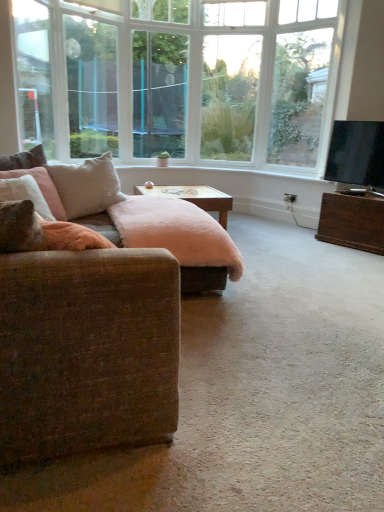
Where is `wooden coffee table at right, which appears as the second table when viewed from the left`? wooden coffee table at right, which appears as the second table when viewed from the left is located at coordinates (352, 221).

What do you see at coordinates (194, 197) in the screenshot? The width and height of the screenshot is (384, 512). I see `woodenobject at center, which is the first table in left-to-right order` at bounding box center [194, 197].

Measure the distance between white soft pillow at upper left, the first pillow from the right, and camera.

white soft pillow at upper left, the first pillow from the right, is 2.67 meters away from camera.

Image resolution: width=384 pixels, height=512 pixels. Describe the element at coordinates (356, 153) in the screenshot. I see `black glossy tv at right` at that location.

The width and height of the screenshot is (384, 512). I want to click on velvet pink pillow at left, which is the second pillow in right-to-left order, so click(24, 159).

In order to click on wooden coffee table at right, placed as the first table when sorted from right to left in this screenshot , I will do `click(352, 221)`.

From a real-world perspective, is white soft pillow at upper left, acting as the second pillow starting from the left, positioned above or below black glossy tv at right?

Clearly, from a real-world perspective, white soft pillow at upper left, acting as the second pillow starting from the left, is below black glossy tv at right.

Can you tell me how much white soft pillow at upper left, the first pillow from the right, and black glossy tv at right differ in facing direction?

179 degrees.

Which of these two, white soft pillow at upper left, the first pillow from the right, or black glossy tv at right, is bigger?

Bigger between the two is white soft pillow at upper left, the first pillow from the right.

Based on the photo, can you confirm if textured brown couch at left is positioned to the left of wooden coffee table at right, placed as the first table when sorted from right to left?

Indeed, textured brown couch at left is positioned on the left side of wooden coffee table at right, placed as the first table when sorted from right to left.

Between textured brown couch at left and wooden coffee table at right, which appears as the second table when viewed from the left, which one has smaller width?

wooden coffee table at right, which appears as the second table when viewed from the left.

Is wooden coffee table at right, placed as the first table when sorted from right to left, surrounded by textured brown couch at left?

No, wooden coffee table at right, placed as the first table when sorted from right to left, is not inside textured brown couch at left.

Based on the photo, how many degrees apart are the facing directions of textured brown couch at left and wooden coffee table at right, which appears as the second table when viewed from the left?

154 degrees.

Is clear glass window screen at upper left, marked as the second window screen in a right-to-left arrangement, at the right side of wooden coffee table at right, which appears as the second table when viewed from the left?

No, clear glass window screen at upper left, marked as the second window screen in a right-to-left arrangement, is not to the right of wooden coffee table at right, which appears as the second table when viewed from the left.

Based on the photo, considering the sizes of objects clear glass window screen at upper left, the first window screen viewed from the left, and wooden coffee table at right, which appears as the second table when viewed from the left, in the image provided, who is shorter, clear glass window screen at upper left, the first window screen viewed from the left, or wooden coffee table at right, which appears as the second table when viewed from the left,?

wooden coffee table at right, which appears as the second table when viewed from the left, is shorter.

From the image's perspective, which one is positioned higher, clear glass window screen at upper left, marked as the second window screen in a right-to-left arrangement, or wooden coffee table at right, which appears as the second table when viewed from the left?

clear glass window screen at upper left, marked as the second window screen in a right-to-left arrangement, appears higher in the image.

How different are the orientations of clear glass window screen at upper left, marked as the second window screen in a right-to-left arrangement, and wooden coffee table at right, which appears as the second table when viewed from the left, in degrees?

The facing directions of clear glass window screen at upper left, marked as the second window screen in a right-to-left arrangement, and wooden coffee table at right, which appears as the second table when viewed from the left, are 93.9 degrees apart.

From a real-world perspective, is woodenobject at center, the 2th table viewed from the right, beneath wooden coffee table at right, which appears as the second table when viewed from the left?

Yes, from a real-world perspective, woodenobject at center, the 2th table viewed from the right, is below wooden coffee table at right, which appears as the second table when viewed from the left.

From the image's perspective, which one is positioned lower, woodenobject at center, which is the first table in left-to-right order, or wooden coffee table at right, placed as the first table when sorted from right to left?

wooden coffee table at right, placed as the first table when sorted from right to left, appears lower in the image.

Is woodenobject at center, which is the first table in left-to-right order, in front of or behind wooden coffee table at right, which appears as the second table when viewed from the left, in the image?

woodenobject at center, which is the first table in left-to-right order, is positioned farther from the viewer than wooden coffee table at right, which appears as the second table when viewed from the left.

What are the coordinates of `table that appears below the wooden coffee table at right, placed as the first table when sorted from right to left (from a real-world perspective)` in the screenshot? It's located at (194, 197).

Who is more distant, clear glass window screen at upper left, marked as the second window screen in a right-to-left arrangement, or black glossy tv at right?

clear glass window screen at upper left, marked as the second window screen in a right-to-left arrangement, is further from the camera.

Looking at this image, considering the sizes of objects clear glass window screen at upper left, the first window screen viewed from the left, and black glossy tv at right in the image provided, who is wider, clear glass window screen at upper left, the first window screen viewed from the left, or black glossy tv at right?

black glossy tv at right is wider.

Considering the positions of point (68, 45) and point (350, 177), is point (68, 45) closer or farther from the camera than point (350, 177)?

Point (68, 45).

At what (x,y) coordinates should I click in order to perform the action: click on the 1st window screen positioned above the black glossy tv at right (from a real-world perspective). Please return your answer as a coordinate pair (x, y). Looking at the image, I should click on (91, 86).

Which object is positioned more to the left, black glossy tv at right or wooden coffee table at right, placed as the first table when sorted from right to left?

black glossy tv at right is more to the left.

Is black glossy tv at right smaller than wooden coffee table at right, placed as the first table when sorted from right to left?

Yes, black glossy tv at right is smaller than wooden coffee table at right, placed as the first table when sorted from right to left.

Is black glossy tv at right inside the boundaries of wooden coffee table at right, placed as the first table when sorted from right to left, or outside?

black glossy tv at right is not enclosed by wooden coffee table at right, placed as the first table when sorted from right to left.

In the image, is black glossy tv at right positioned in front of or behind wooden coffee table at right, placed as the first table when sorted from right to left?

black glossy tv at right is in front of wooden coffee table at right, placed as the first table when sorted from right to left.

Which is more to the right, clear glass window screen at upper left, marked as the second window screen in a right-to-left arrangement, or clear glass window screen at center, marked as the 1th window screen in a right-to-left arrangement?

From the viewer's perspective, clear glass window screen at center, marked as the 1th window screen in a right-to-left arrangement, appears more on the right side.

Is clear glass window screen at center, marked as the 1th window screen in a right-to-left arrangement, inside clear glass window screen at upper left, the first window screen viewed from the left?

That's incorrect, clear glass window screen at center, marked as the 1th window screen in a right-to-left arrangement, is not inside clear glass window screen at upper left, the first window screen viewed from the left.

From a real-world perspective, is clear glass window screen at upper left, marked as the second window screen in a right-to-left arrangement, under clear glass window screen at center, which ranks as the second window screen in left-to-right order?

Yes.

In the scene shown: Is clear glass window screen at upper left, the first window screen viewed from the left, bigger than clear glass window screen at center, which ranks as the second window screen in left-to-right order?

Correct, clear glass window screen at upper left, the first window screen viewed from the left, is larger in size than clear glass window screen at center, which ranks as the second window screen in left-to-right order.

Where is `the 2nd pillow in front of the black glossy tv at right, counting from the anchor's position`? The image size is (384, 512). the 2nd pillow in front of the black glossy tv at right, counting from the anchor's position is located at coordinates (87, 186).

There is a textured brown couch at left. At what (x,y) coordinates should I click in order to perform the action: click on the 1st table below it (from a real-world perspective). Please return your answer as a coordinate pair (x, y). This screenshot has height=512, width=384. Looking at the image, I should click on (x=352, y=221).

Estimate the real-world distances between objects in this image. Which object is further from wooden coffee table at right, which appears as the second table when viewed from the left, clear glass window screen at upper left, the first window screen viewed from the left, or clear glass window screen at center, which ranks as the second window screen in left-to-right order?

clear glass window screen at upper left, the first window screen viewed from the left, is positioned further to the anchor wooden coffee table at right, which appears as the second table when viewed from the left.

From the image, which object appears to be nearer to wooden coffee table at right, which appears as the second table when viewed from the left, white soft pillow at upper left, acting as the second pillow starting from the left, or velvet pink pillow at left, acting as the first pillow starting from the left?

white soft pillow at upper left, acting as the second pillow starting from the left, is closer to wooden coffee table at right, which appears as the second table when viewed from the left.

When comparing their distances from black glossy tv at right, does wooden coffee table at right, placed as the first table when sorted from right to left, or velvet pink pillow at left, which is the second pillow in right-to-left order, seem further?

velvet pink pillow at left, which is the second pillow in right-to-left order, is positioned further to the anchor black glossy tv at right.

From the picture: Looking at the image, which one is located further to black glossy tv at right, textured brown couch at left or clear glass window screen at upper left, the first window screen viewed from the left?

Among the two, clear glass window screen at upper left, the first window screen viewed from the left, is located further to black glossy tv at right.

Looking at the image, which one is located closer to clear glass window screen at center, marked as the 1th window screen in a right-to-left arrangement, white soft pillow at upper left, acting as the second pillow starting from the left, or clear glass window screen at upper left, the first window screen viewed from the left?

Based on the image, clear glass window screen at upper left, the first window screen viewed from the left, appears to be nearer to clear glass window screen at center, marked as the 1th window screen in a right-to-left arrangement.

Estimate the real-world distances between objects in this image. Which object is closer to wooden coffee table at right, placed as the first table when sorted from right to left, woodenobject at center, which is the first table in left-to-right order, or clear glass window screen at center, which ranks as the second window screen in left-to-right order?

woodenobject at center, which is the first table in left-to-right order.

Estimate the real-world distances between objects in this image. Which object is further from black glossy tv at right, woodenobject at center, which is the first table in left-to-right order, or white soft pillow at upper left, the first pillow from the right?

Based on the image, white soft pillow at upper left, the first pillow from the right, appears to be further to black glossy tv at right.

Which object lies nearer to the anchor point fuzzy pink ottoman at center, clear glass window screen at upper left, marked as the second window screen in a right-to-left arrangement, or black glossy tv at right?

The object closer to fuzzy pink ottoman at center is black glossy tv at right.

Find the location of a particular element. The image size is (384, 512). window screen between fuzzy pink ottoman at center and clear glass window screen at center, marked as the 1th window screen in a right-to-left arrangement, in the front-back direction is located at coordinates (91, 86).

Locate an element on the screen. The image size is (384, 512). television positioned between textured brown couch at left and clear glass window screen at upper left, marked as the second window screen in a right-to-left arrangement, from near to far is located at coordinates (356, 153).

In order to click on window screen between white soft pillow at upper left, acting as the second pillow starting from the left, and black glossy tv at right in this screenshot , I will do `click(159, 93)`.

Locate an element on the screen. The width and height of the screenshot is (384, 512). television located between textured brown couch at left and woodenobject at center, which is the first table in left-to-right order, in the depth direction is located at coordinates (356, 153).